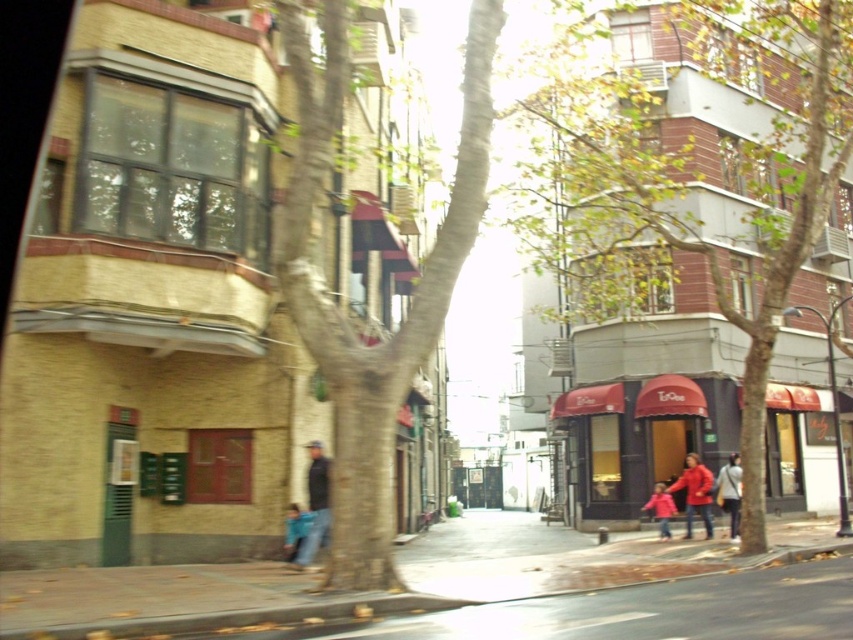
You are a pedestrian standing at the center of the street. You see a green textured tree at center and a matte red jacket at center. Which object is higher in height?

The green textured tree at center is taller than the matte red jacket at center.

You are a delivery person trying to navigate through the street scene. You notice a red awning at center and a matte red jacket at center. Which object is shorter in height?

The red awning at center is shorter in height compared to the matte red jacket at center.

You are standing on the street and see two points marked on the buildings. The first point is at coordinates point (693, 445) and the second is at point (711, 532). Which point is closer to you?

The point at (693, 445) is closer to you because it is further to the viewer than the point at (711, 532).